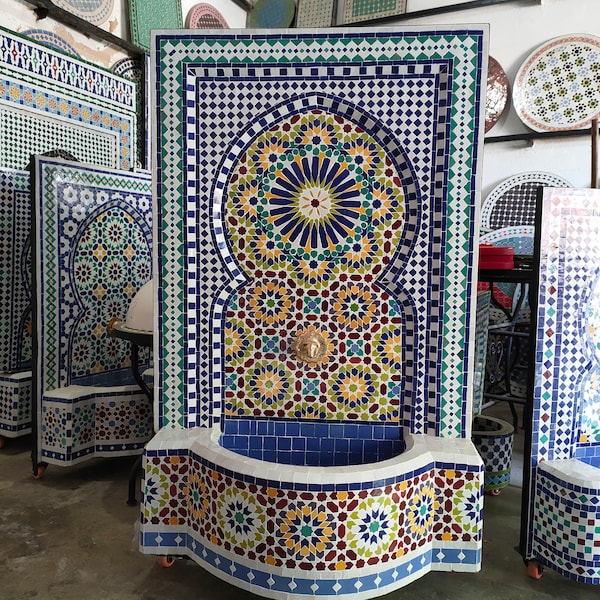
This screenshot has width=600, height=600. I want to click on steel rack, so click(x=519, y=278).